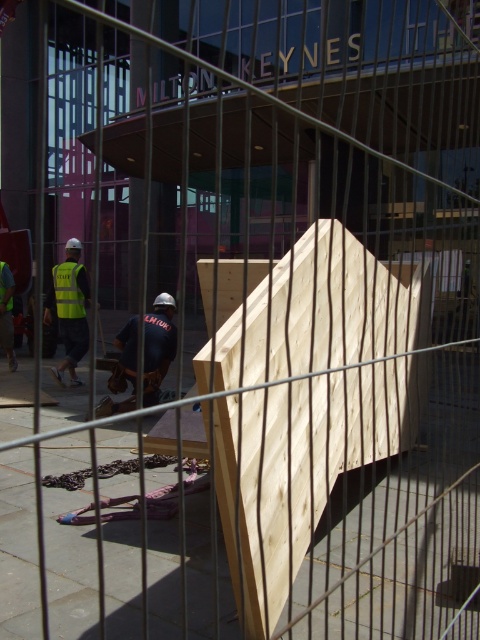
You are a safety inspector standing at the camera position. You need to check if the worker in the yellow reflective vest at left is within the safe inspection range of 10 meters. Can you confirm?

The distance of yellow reflective vest at left from camera is 8.90 meters, which is within the 10 meters safe inspection range. Yes, the worker in the yellow reflective vest at left is within the safe inspection range.

From the picture: You are a safety inspector observing the construction site through the fence. You notice two safety vests in the scene. Which vest is closer to the bottom edge of the fence? The yellow reflective vest at left and the high visibility fabric safety vest at lower left are both visible. Please identify the one closer to the bottom edge.

The yellow reflective vest at left is positioned under the high visibility fabric safety vest at lower left, meaning the yellow reflective vest at left is closer to the bottom edge of the fence.